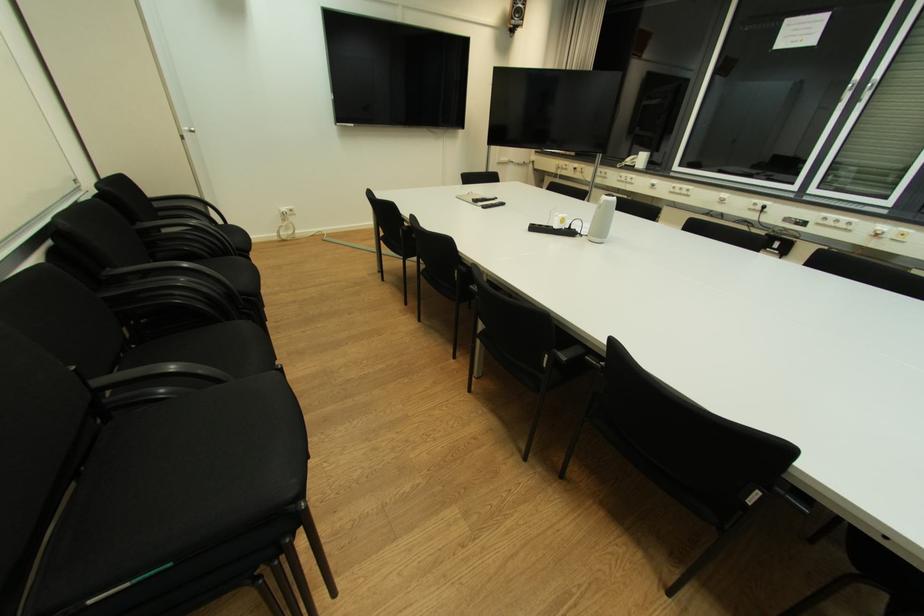
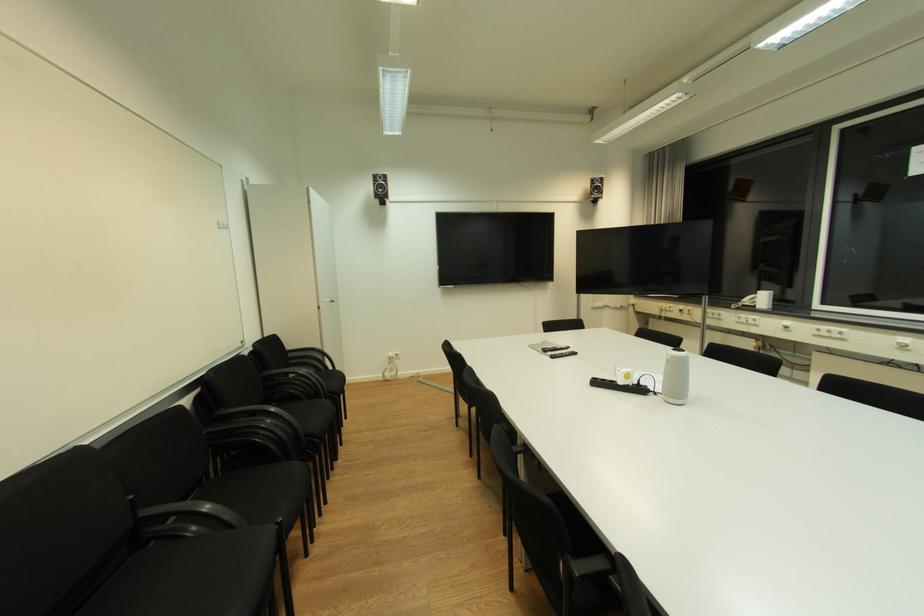
In the second image, find the point that corresponds to pixel 576 225 in the first image.

(645, 381)